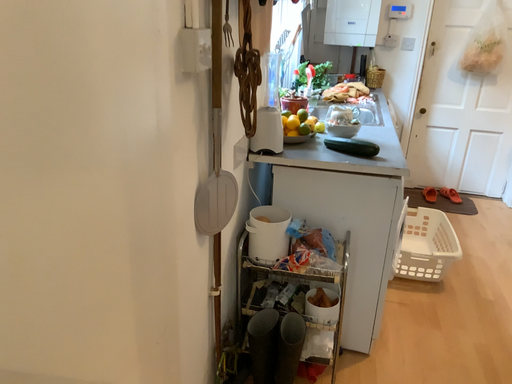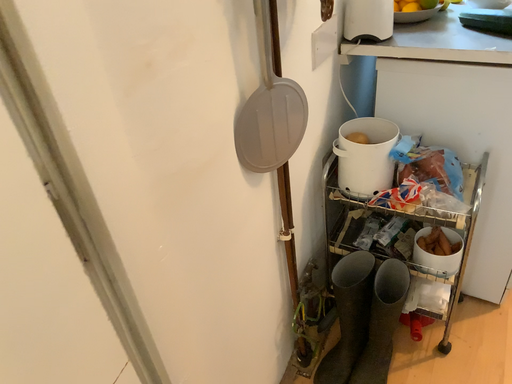
Question: How did the camera likely rotate when shooting the video?

Choices:
 (A) rotated left
 (B) rotated right

Answer: (A)